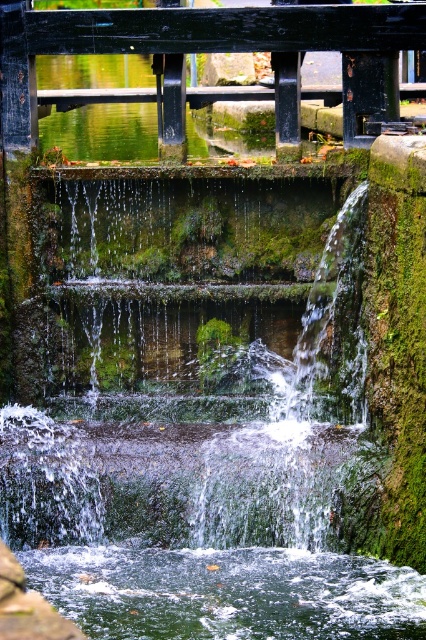
Which is above, green mossy waterfall at center or green mossy water at lower center?

green mossy waterfall at center is higher up.

Which is in front, point (111, 316) or point (362, 611)?

Point (362, 611) is in front.

Does point (14, 481) come farther from viewer compared to point (160, 564)?

Yes.

Locate an element on the screen. Image resolution: width=426 pixels, height=640 pixels. green mossy waterfall at center is located at coordinates (186, 416).